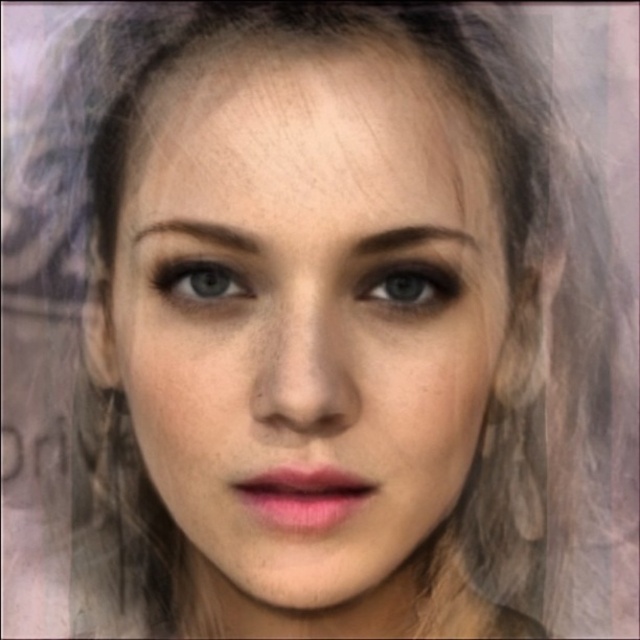
Who is shorter, matte blue eye at center or brown matte eyebrow at center?

matte blue eye at center is shorter.

Does point (205, 282) lie behind point (454, 228)?

That is False.

Is point (243, 285) behind point (401, 246)?

Yes, point (243, 285) is behind point (401, 246).

Locate an element on the screen. This screenshot has height=640, width=640. matte blue eye at center is located at coordinates (202, 282).

Can you confirm if smooth skin face at center is positioned above blue matte eye at center?

Actually, smooth skin face at center is below blue matte eye at center.

Is smooth skin face at center taller than blue matte eye at center?

Yes.

Find the location of a particular element. Image resolution: width=640 pixels, height=640 pixels. smooth skin face at center is located at coordinates (305, 310).

Identify the location of smooth skin face at center. (305, 310).

Between point (193, 321) and point (186, 225), which one is positioned in front?

Point (186, 225)

The image size is (640, 640). What are the coordinates of `smooth skin face at center` in the screenshot? It's located at (305, 310).